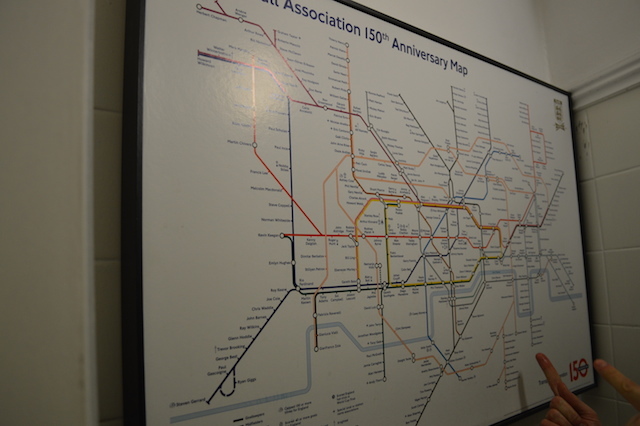
Locate an element on the screen. This screenshot has width=640, height=426. molding is located at coordinates (612, 79).